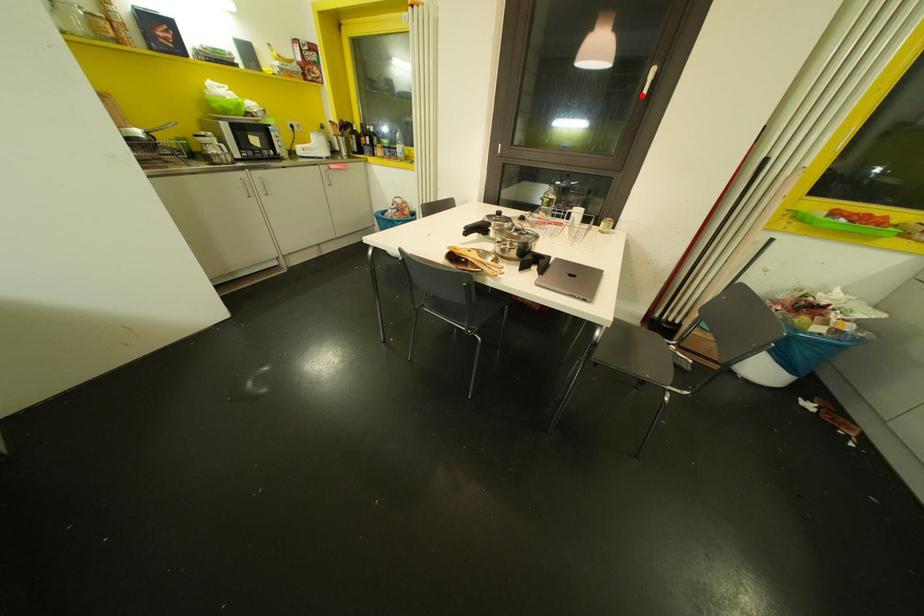
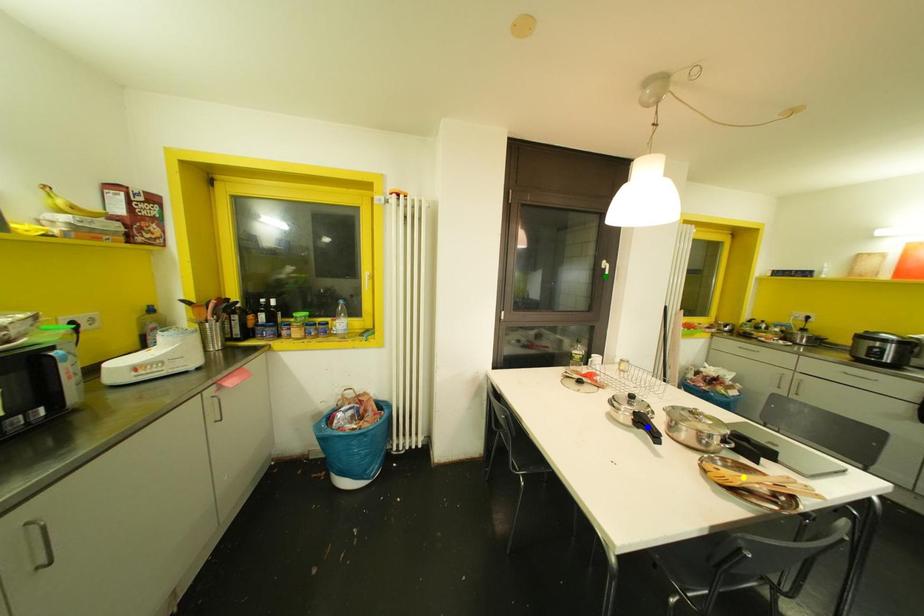
Question: I am providing you with two images of the same scene from different viewpoints. A red point is marked on the first image. You are given multiple points on the second image. Which point in image 2 is actually the same real-world point as the red point in image 1?

Choices:
 (A) green point
 (B) blue point
 (C) yellow point

Answer: (A)